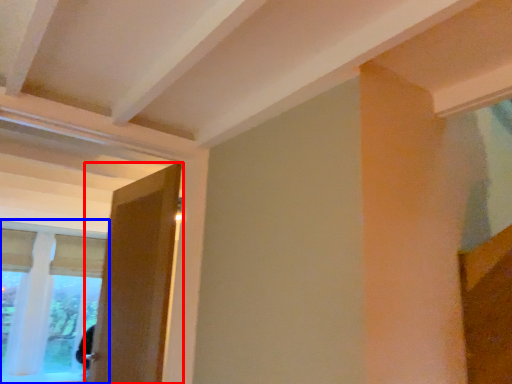
Question: Which point is closer to the camera, door (highlighted by a red box) or window (highlighted by a blue box)?

Choices:
 (A) door
 (B) window

Answer: (A)